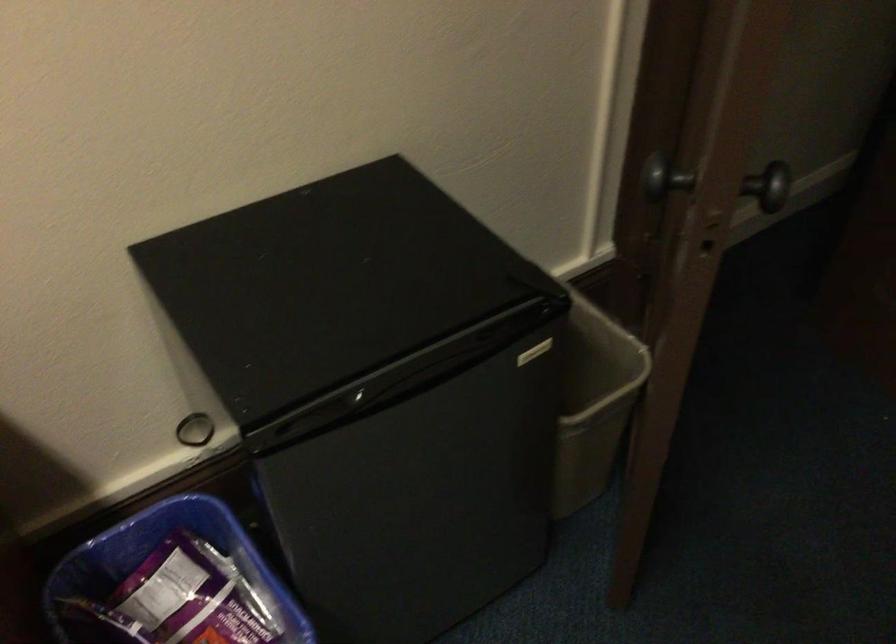
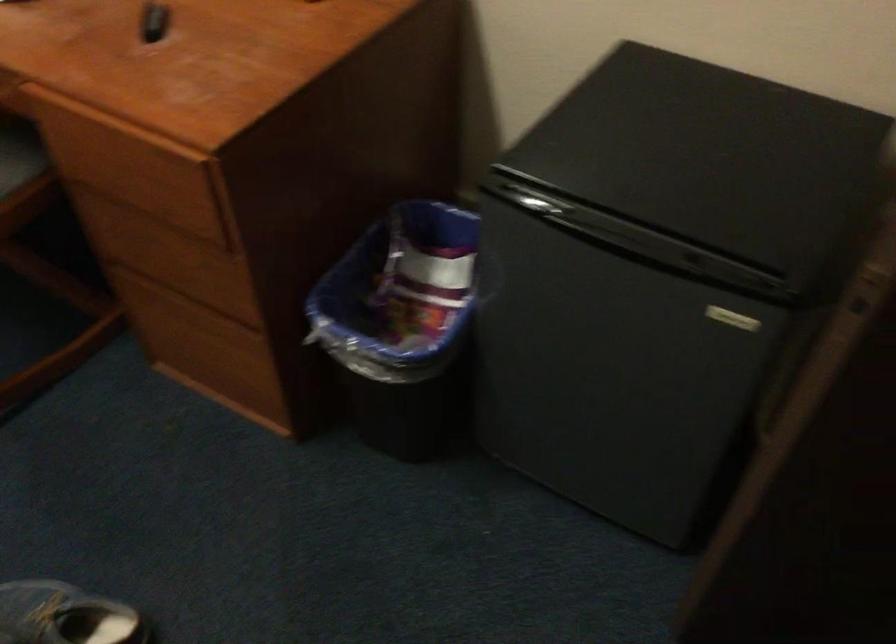
The images are taken continuously from a first-person perspective. In which direction is your viewpoint rotating?

The camera's rotation is toward left-down.